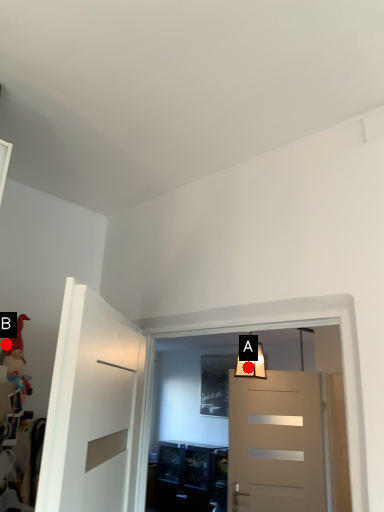
Question: Two points are circled on the image, labeled by A and B beside each circle. Which point is farther from the camera taking this photo?

Choices:
 (A) A is further
 (B) B is further

Answer: (A)